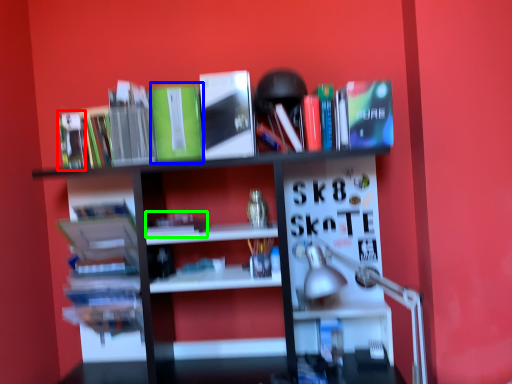
Question: Which object is positioned farthest from book (highlighted by a red box)? Select from paperback book (highlighted by a blue box) and book (highlighted by a green box).

Choices:
 (A) paperback book
 (B) book

Answer: (B)